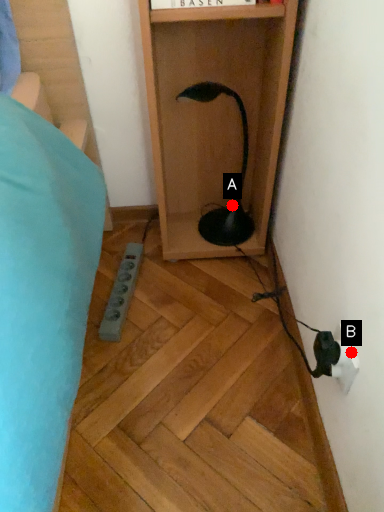
Question: Two points are circled on the image, labeled by A and B beside each circle. Which point is farther to the camera?

Choices:
 (A) A is further
 (B) B is further

Answer: (A)